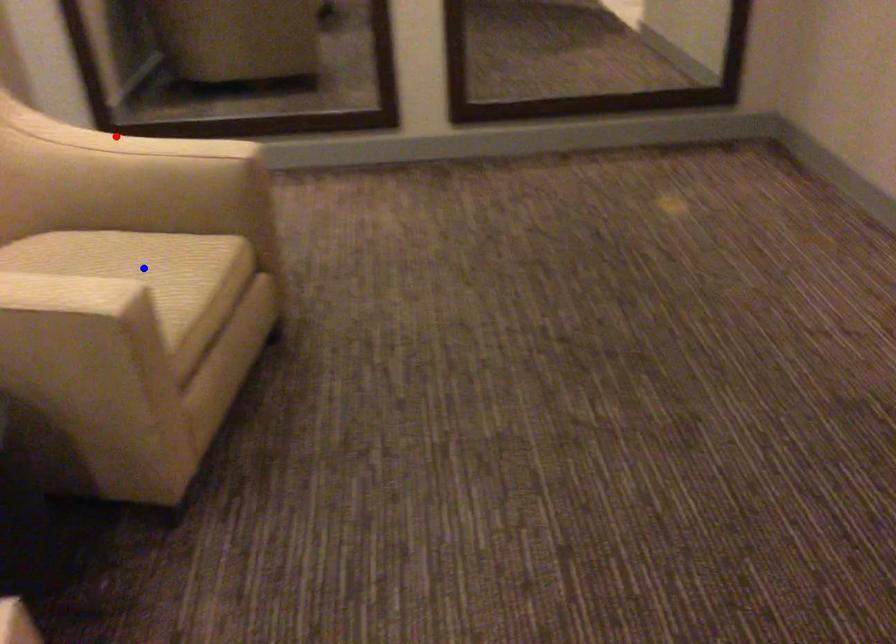
Question: In the image, two points are highlighted. Which point is nearer to the camera? Reply with the corresponding letter.

Choices:
 (A) blue point
 (B) red point

Answer: (A)